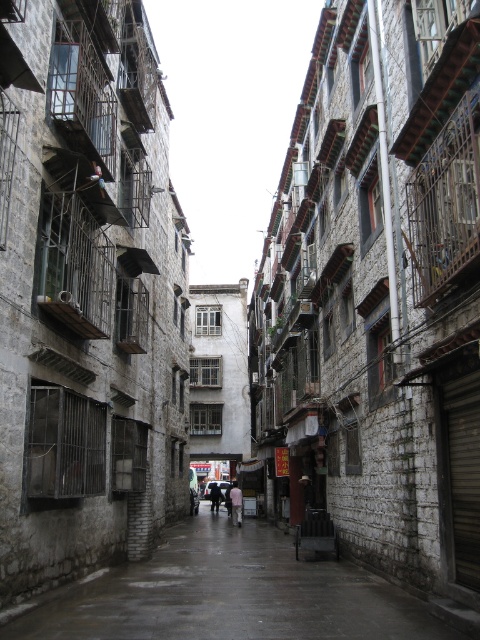
Can you confirm if smooth stone pavement at center is thinner than dark gray fabric coat at center?

Incorrect, smooth stone pavement at center's width is not less than dark gray fabric coat at center's.

Can you confirm if smooth stone pavement at center is positioned below dark gray fabric coat at center?

No, smooth stone pavement at center is not below dark gray fabric coat at center.

Who is more forward, (x=205, y=550) or (x=218, y=497)?

Point (x=205, y=550) is more forward.

Locate an element on the screen. Image resolution: width=480 pixels, height=640 pixels. smooth stone pavement at center is located at coordinates coord(230,595).

Is point (288, 540) farther from camera compared to point (211, 483)?

No, it is not.

Is smooth stone pavement at center bigger than transparent plastic umbrella at center?

Incorrect, smooth stone pavement at center is not larger than transparent plastic umbrella at center.

Identify the location of smooth stone pavement at center. tap(230, 595).

Is pink fabric person at center positioned behind transparent plastic umbrella at center?

No, it is not.

Does pink fabric person at center have a smaller size compared to transparent plastic umbrella at center?

Yes, pink fabric person at center is smaller than transparent plastic umbrella at center.

Does point (237, 508) lie in front of point (228, 484)?

Yes.

Locate an element on the screen. pink fabric person at center is located at coordinates (236, 502).